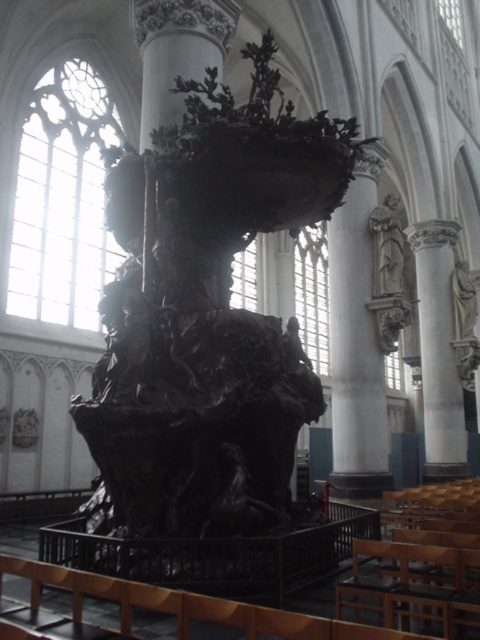
Looking at this image, you are an art conservator assessing the cathedral interior. You need to inspect both the white marble statue at center and the polished stone statue at right. Which statue is located above the other?

The polished stone statue at right is above the white marble statue at center because the white marble statue at center is positioned under the polished stone statue at right.

You are standing in the cathedral and want to take a photo of both the dark sculpture at the center and the intricate tracery on the arched windows. You notice two points marked as point 1 at coordinates (371, 198) and point 2 at coordinates (391, 211). Which point should you stand closer to in order to capture both the sculpture and the window details in the same frame?

You should stand closer to point 2 at coordinates (391, 211) because point 1 is behind point 2, meaning point 2 is closer to you. Being closer to point 2 allows you to include both the sculpture and the window details in your photo frame.